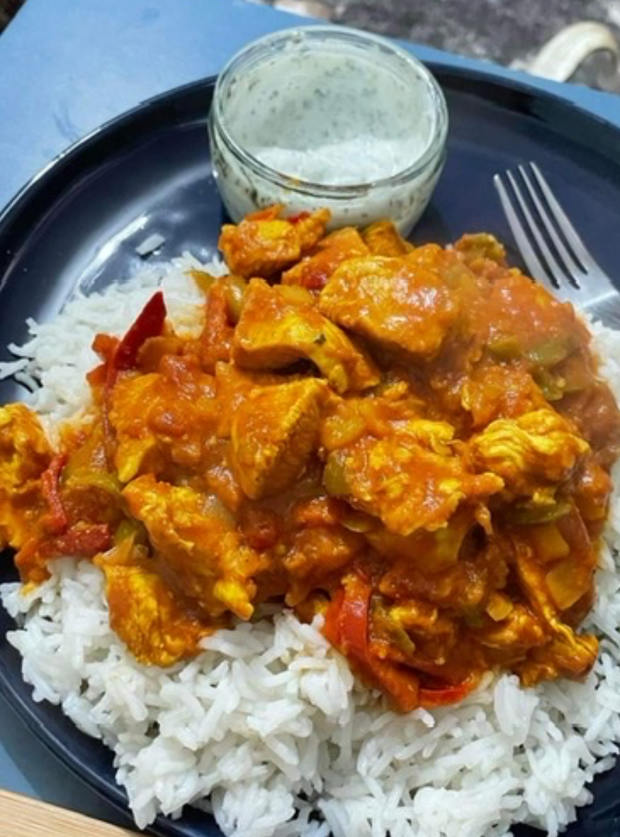
This screenshot has height=837, width=620. Identify the location of table. (59, 824).